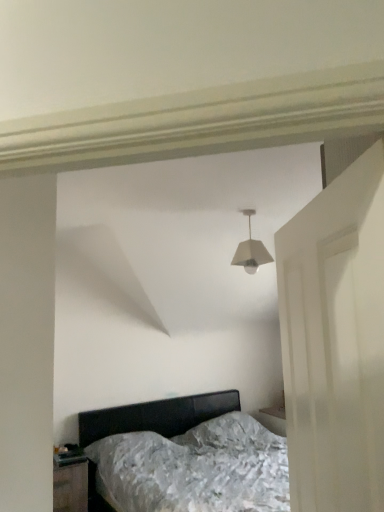
Question: Considering their positions, is white matte door at right located in front of or behind white matte lampshade at center?

Choices:
 (A) behind
 (B) front

Answer: (B)

Question: Is white matte door at right spatially inside white matte lampshade at center, or outside of it?

Choices:
 (A) inside
 (B) outside

Answer: (B)

Question: Considering the real-world distances, which object is closest to the black glossy nightstand at lower left?

Choices:
 (A) white matte lampshade at center
 (B) metallic silver bed at center
 (C) white matte door at right

Answer: (B)

Question: Estimate the real-world distances between objects in this image. Which object is farther from the black glossy nightstand at lower left?

Choices:
 (A) metallic silver bed at center
 (B) white matte door at right
 (C) white matte lampshade at center

Answer: (B)